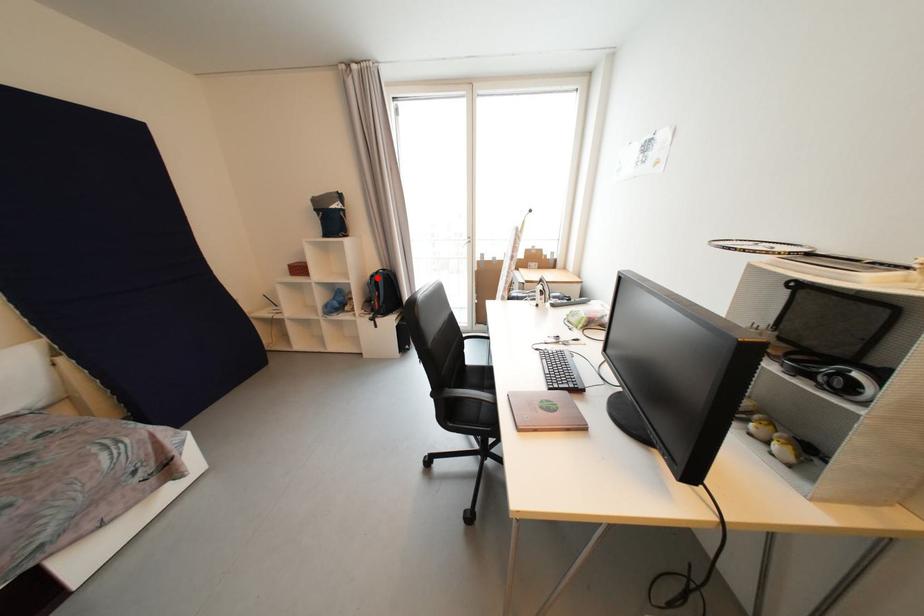
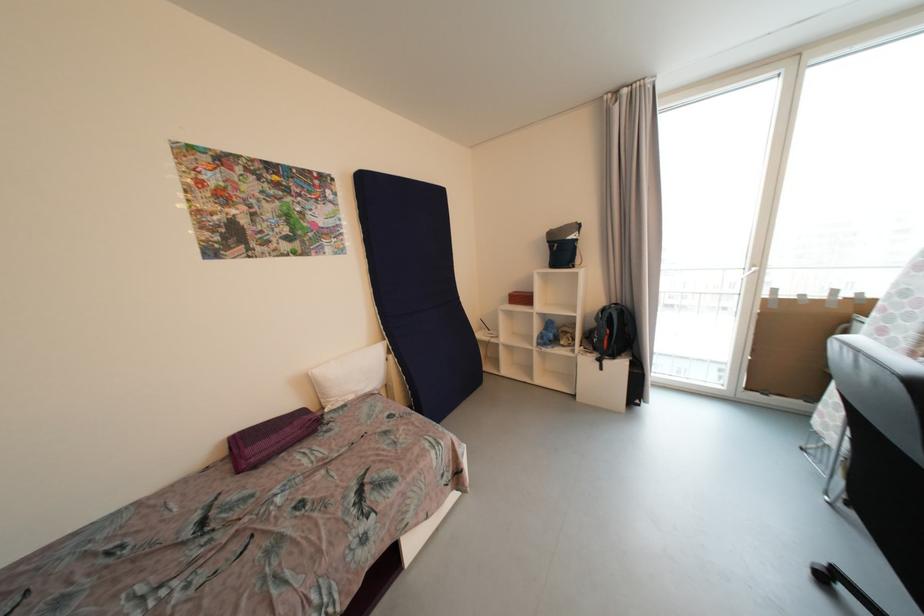
Where in the second image is the point corresponding to the highlighted location from the first image?

(608, 312)